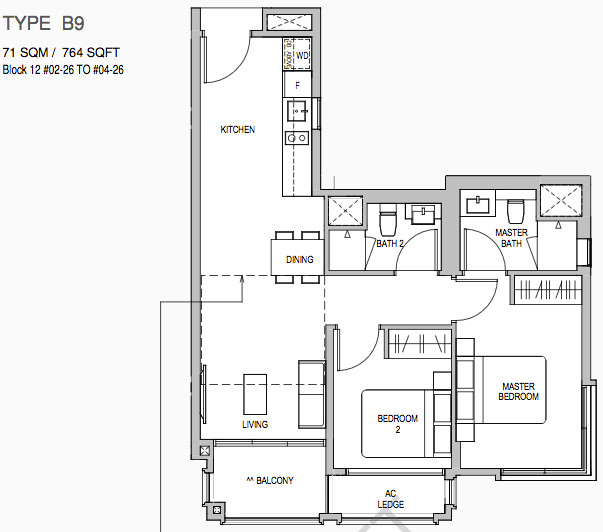
Find the location of a particular element. Image resolution: width=603 pixels, height=532 pixels. dining is located at coordinates (300, 259).